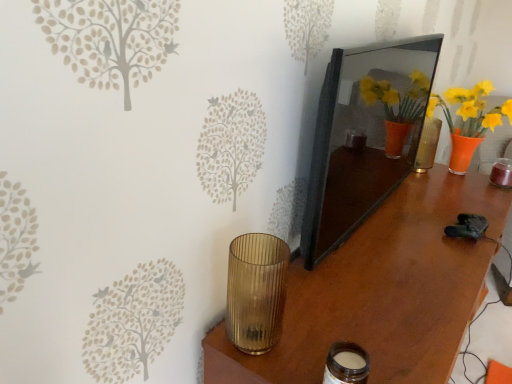
Where is `spots to the right of gold ribbed glass at lower left, which appears as the 1th candle holder when viewed from the left`? This screenshot has height=384, width=512. spots to the right of gold ribbed glass at lower left, which appears as the 1th candle holder when viewed from the left is located at coordinates (328, 334).